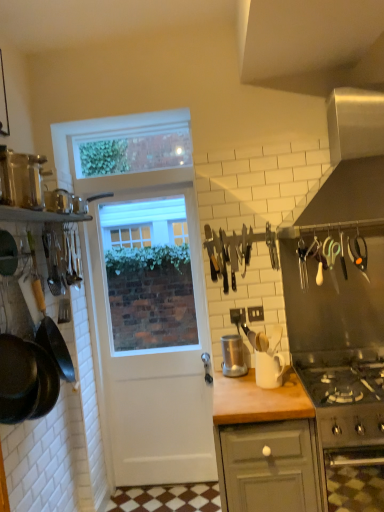
Question: Considering the positions of metallic silver canisters at upper left, acting as the 1th kitchen appliance starting from the top, and stainless steel oven at lower right in the image, is metallic silver canisters at upper left, acting as the 1th kitchen appliance starting from the top, taller or shorter than stainless steel oven at lower right?

Choices:
 (A) short
 (B) tall

Answer: (A)

Question: Considering their positions, is metallic silver canisters at upper left, acting as the 1th kitchen appliance starting from the top, located in front of or behind stainless steel oven at lower right?

Choices:
 (A) front
 (B) behind

Answer: (A)

Question: Considering the real-world distances, which object is closest to the metallic silver canisters at upper left, arranged as the 3th kitchen appliance when viewed from the right?

Choices:
 (A) black matte frying pan at left
 (B) matte gray cabinet at lower center
 (C) satin silver exhaust hood at upper right
 (D) stainless steel oven at lower right
 (E) white ceramic mug at center, the third kitchen appliance when ordered from top to bottom

Answer: (A)

Question: Considering the real-world distances, which object is farthest from the black matte frying pan at left?

Choices:
 (A) metallic stainless steel blender at center, positioned as the 2th kitchen appliance in bottom-to-top order
 (B) satin silver exhaust hood at upper right
 (C) metallic silver canisters at upper left, acting as the 1th kitchen appliance starting from the front
 (D) clear plastic window screen at upper center
 (E) matte gray cabinet at lower center

Answer: (B)